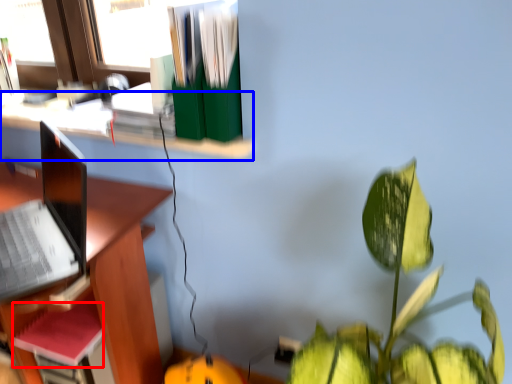
Question: Among these objects, which one is farthest to the camera, paperback book (highlighted by a red box) or shelf (highlighted by a blue box)?

Choices:
 (A) paperback book
 (B) shelf

Answer: (A)